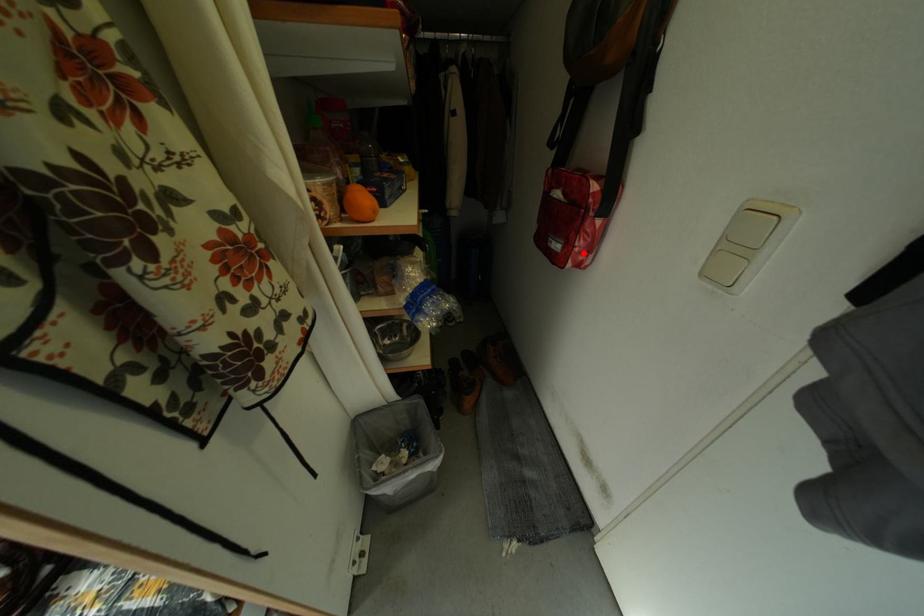
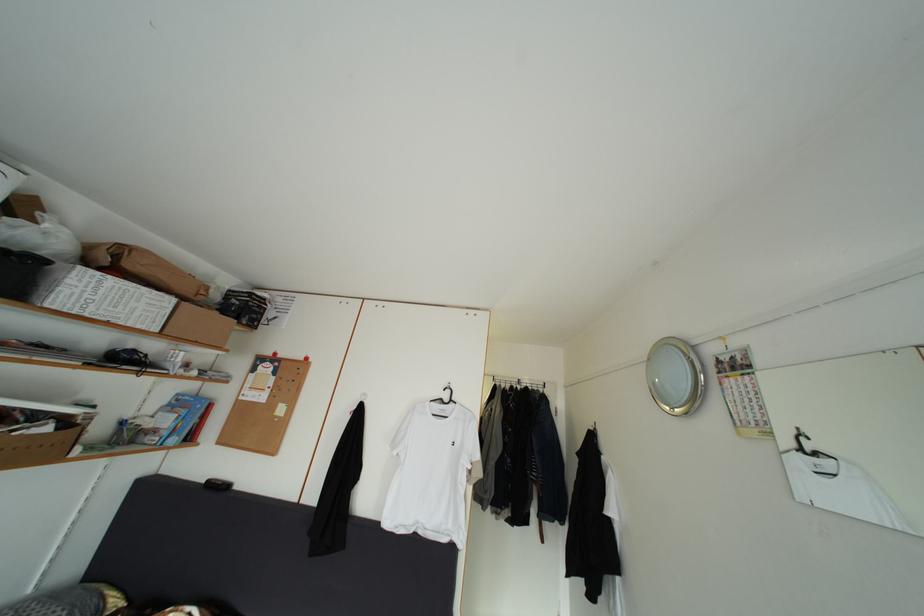
Question: I am providing you with two images of the same scene from different viewpoints. A red point is marked on the first image. Is the red point's position out of view in image 2?

Choices:
 (A) Yes
 (B) No

Answer: (A)